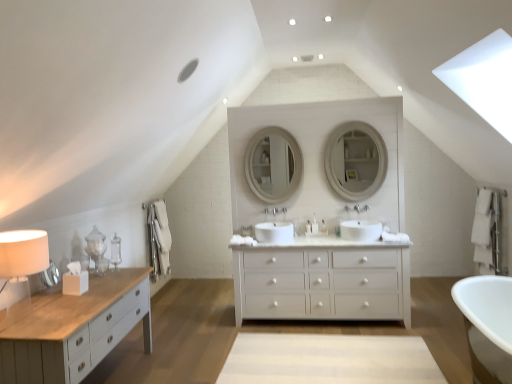
This screenshot has height=384, width=512. I want to click on free point above white striped rug at center (from a real-world perspective), so click(295, 354).